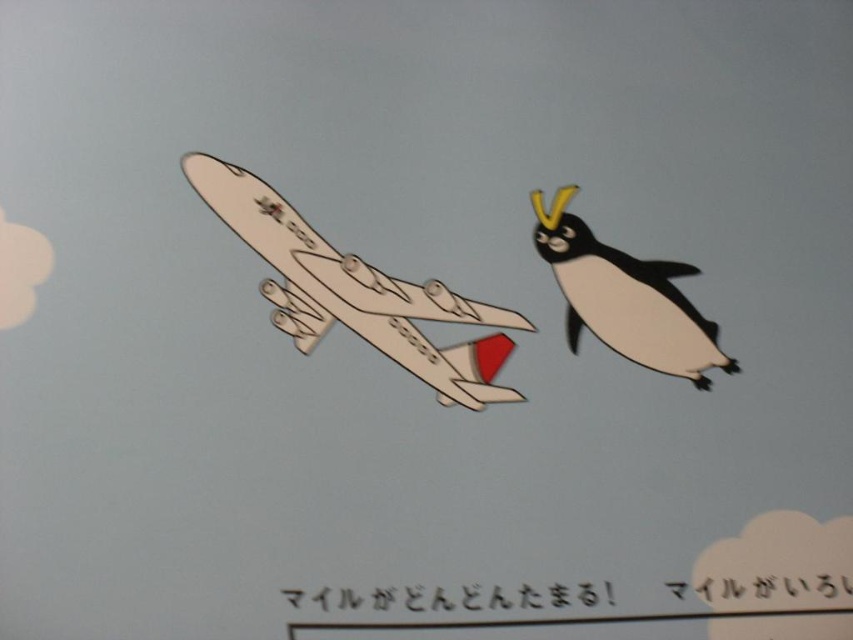
Question: Does white cardboard airplane at center have a lesser width compared to white paper penguin at right?

Choices:
 (A) yes
 (B) no

Answer: (B)

Question: Which object appears farthest from the camera in this image?

Choices:
 (A) white paper penguin at right
 (B) white cardboard airplane at center

Answer: (A)

Question: Is white cardboard airplane at center to the right of white paper penguin at right from the viewer's perspective?

Choices:
 (A) yes
 (B) no

Answer: (B)

Question: Among these points, which one is farthest from the camera?

Choices:
 (A) (694, 314)
 (B) (292, 298)

Answer: (A)

Question: Is white cardboard airplane at center bigger than white paper penguin at right?

Choices:
 (A) yes
 (B) no

Answer: (A)